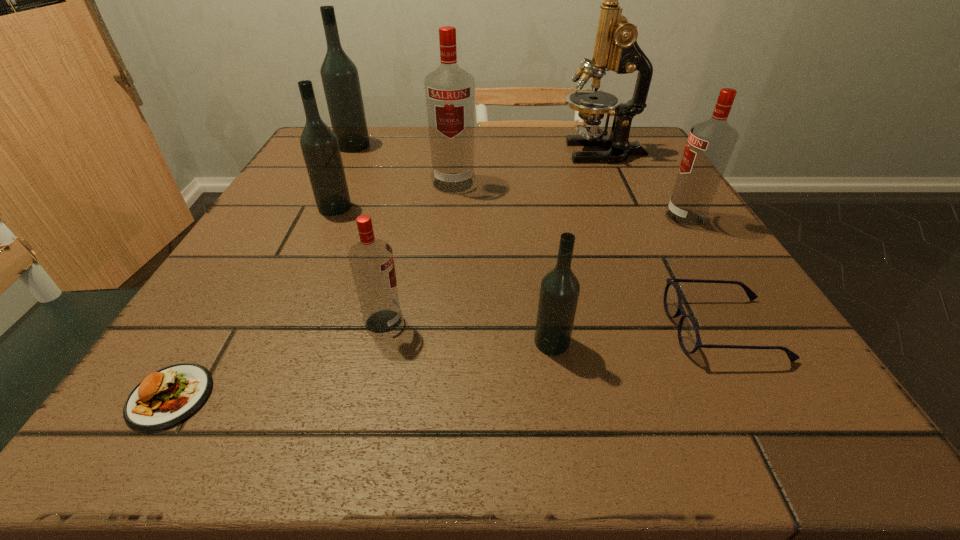
I want to click on microscope, so click(616, 49).

Image resolution: width=960 pixels, height=540 pixels. Identify the location of the farthest vodka. (340, 79).

At what (x,y) coordinates should I click in order to perform the action: click on the farthest black vodka. Please return your answer as a coordinate pair (x, y). Looking at the image, I should click on (340, 79).

The image size is (960, 540). What are the coordinates of `the biggest red vodka` in the screenshot? It's located at (450, 91).

This screenshot has width=960, height=540. In order to click on the fifth object from right to left in this screenshot , I will do `click(450, 91)`.

Find the location of a particular element. the second nearest red vodka is located at coordinates click(x=710, y=144).

This screenshot has width=960, height=540. I want to click on the second biggest red vodka, so click(x=710, y=144).

At what (x,y) coordinates should I click in order to perform the action: click on the second biggest black vodka. Please return your answer as a coordinate pair (x, y). Looking at the image, I should click on (319, 144).

The height and width of the screenshot is (540, 960). What are the coordinates of `the nearest red vodka` in the screenshot? It's located at (371, 260).

You are a GUI agent. You are given a task and a screenshot of the screen. Output one action in this format:
    pyautogui.click(x=<x>, y=<y>)
    Task: Click on the third vodka from left to right
    
    Given the screenshot: What is the action you would take?
    pyautogui.click(x=371, y=260)